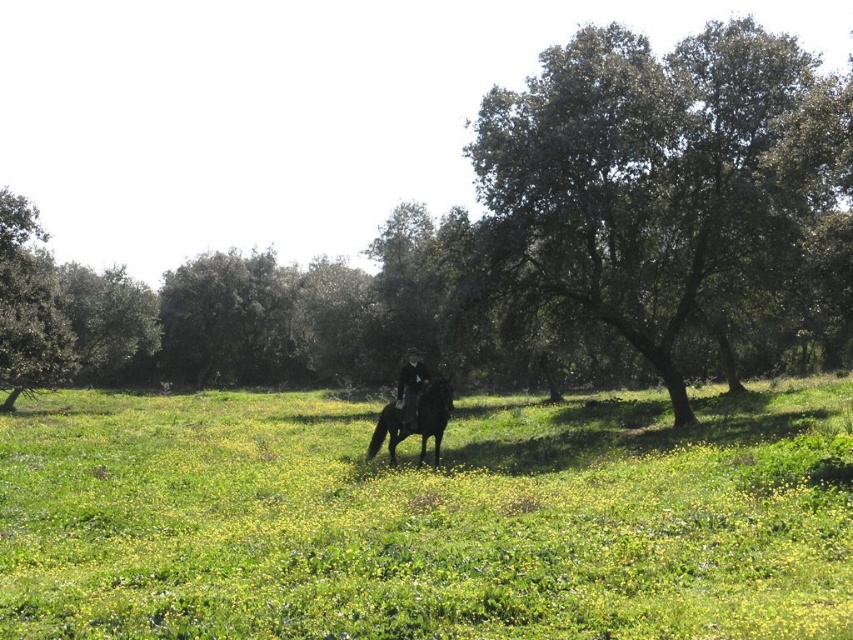
Question: Which object appears farthest from the camera in this image?

Choices:
 (A) shiny black horse at center
 (B) green grassy pasture at center
 (C) green leafy tree at left

Answer: (C)

Question: Considering the real-world distances, which object is farthest from the green grassy pasture at center?

Choices:
 (A) shiny black horse at center
 (B) green leafy tree at left
 (C) green leafy tree at upper right

Answer: (B)

Question: Is green leafy tree at left to the right of shiny black horse at center from the viewer's perspective?

Choices:
 (A) no
 (B) yes

Answer: (A)

Question: Can you confirm if green grassy pasture at center is bigger than shiny black horse at center?

Choices:
 (A) yes
 (B) no

Answer: (A)

Question: Which of the following is the closest to the observer?

Choices:
 (A) (389, 429)
 (B) (45, 364)

Answer: (A)

Question: Can you confirm if green leafy tree at upper right is positioned to the left of green leafy tree at left?

Choices:
 (A) no
 (B) yes

Answer: (A)